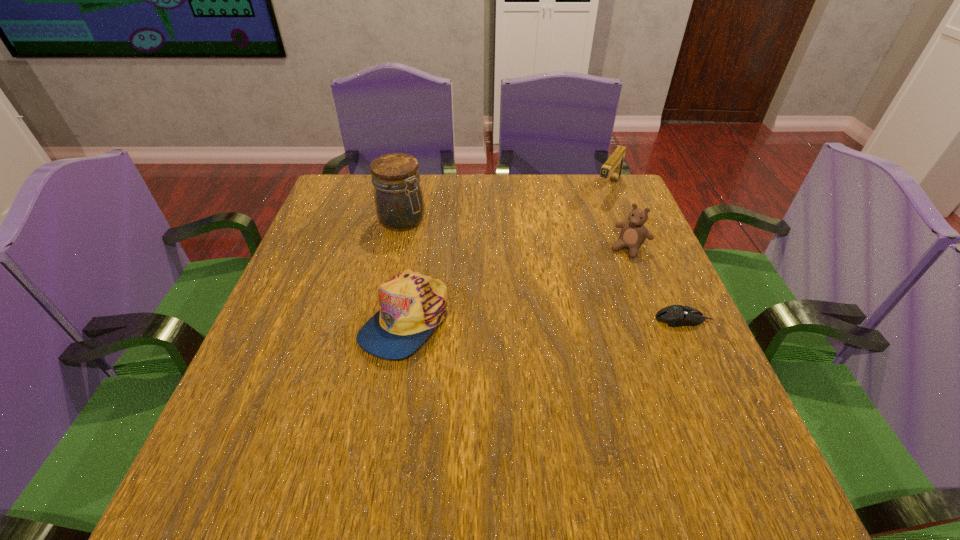
Identify the location of teddy bear that is positioned at the right edge. This screenshot has width=960, height=540. (633, 233).

At what (x,y) coordinates should I click in order to perform the action: click on pistol present at the right edge. Please return your answer as a coordinate pair (x, y). This screenshot has width=960, height=540. Looking at the image, I should click on (613, 166).

I want to click on object that is at the far right corner, so click(613, 166).

Locate an element on the screen. Image resolution: width=960 pixels, height=540 pixels. vacant region at the far edge of the desktop is located at coordinates (566, 181).

I want to click on vacant space at the near edge of the desktop, so click(348, 418).

In the image, there is a desktop. Where is `vacant space at the left edge`? vacant space at the left edge is located at coordinates (362, 266).

Locate an element on the screen. vacant space at the right edge of the desktop is located at coordinates (675, 336).

You are a GUI agent. You are given a task and a screenshot of the screen. Output one action in this format:
    pyautogui.click(x=<x>, y=<y>)
    Task: Click on the vacant region at the far right corner
    The width and height of the screenshot is (960, 540).
    Given the screenshot: What is the action you would take?
    click(594, 204)

Find the location of a particular element. vacant area that lies between the shortest object and the teddy bear is located at coordinates (656, 284).

This screenshot has height=540, width=960. I want to click on vacant space in between the second farthest object and the teddy bear, so click(x=516, y=234).